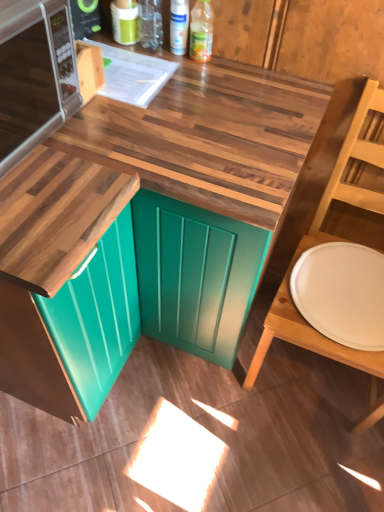
Locate an element on the screen. free point above wooden at center (from a real-world perspective) is located at coordinates (150, 96).